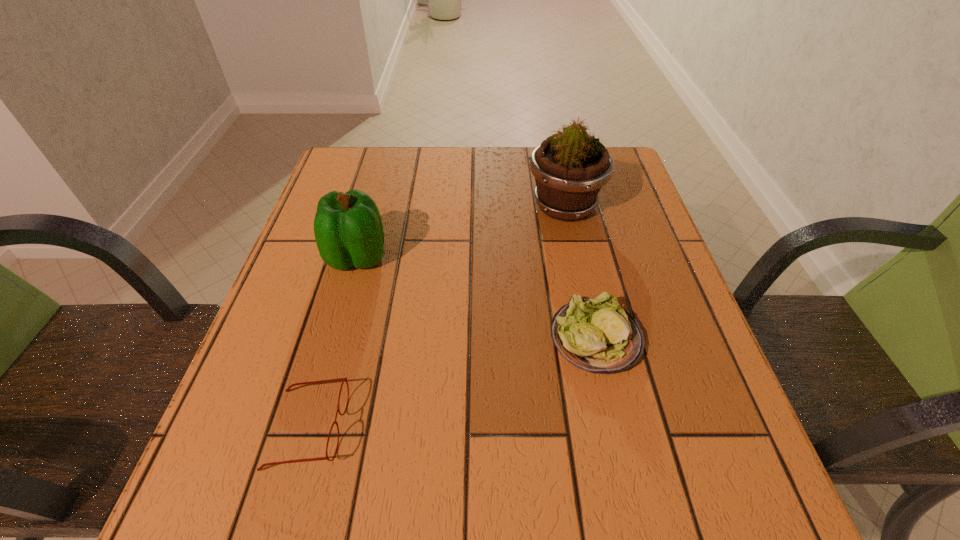
Locate an element on the screen. This screenshot has height=540, width=960. vacant space that's between the lettuce and the tallest object is located at coordinates (580, 272).

At what (x,y) coordinates should I click in order to perform the action: click on free space between the spectacles and the tallest object. Please return your answer as a coordinate pair (x, y). Looking at the image, I should click on (436, 317).

Find the location of `unoccupied area between the second shortest object and the shortest object`. unoccupied area between the second shortest object and the shortest object is located at coordinates (451, 383).

At what (x,y) coordinates should I click in order to perform the action: click on free space between the flowerpot and the third farthest object. Please return your answer as a coordinate pair (x, y). Image resolution: width=960 pixels, height=540 pixels. Looking at the image, I should click on (580, 272).

Identify the location of unoccupied position between the second shortest object and the farthest object. (580, 272).

You are a GUI agent. You are given a task and a screenshot of the screen. Output one action in this format:
    pyautogui.click(x=<x>, y=<y>)
    Task: Click on the third closest object to the lettuce
    
    Given the screenshot: What is the action you would take?
    pyautogui.click(x=340, y=379)

Point out which object is positioned as the second nearest to the tallest object. Please provide its 2D coordinates. Your answer should be formatted as a tuple, i.e. [(x, y)], where the tuple contains the x and y coordinates of a point satisfying the conditions above.

[(348, 229)]

The image size is (960, 540). I want to click on free space that satisfies the following two spatial constraints: 1. on the front side of the tallest object; 2. on the face of the spectacles, so click(612, 428).